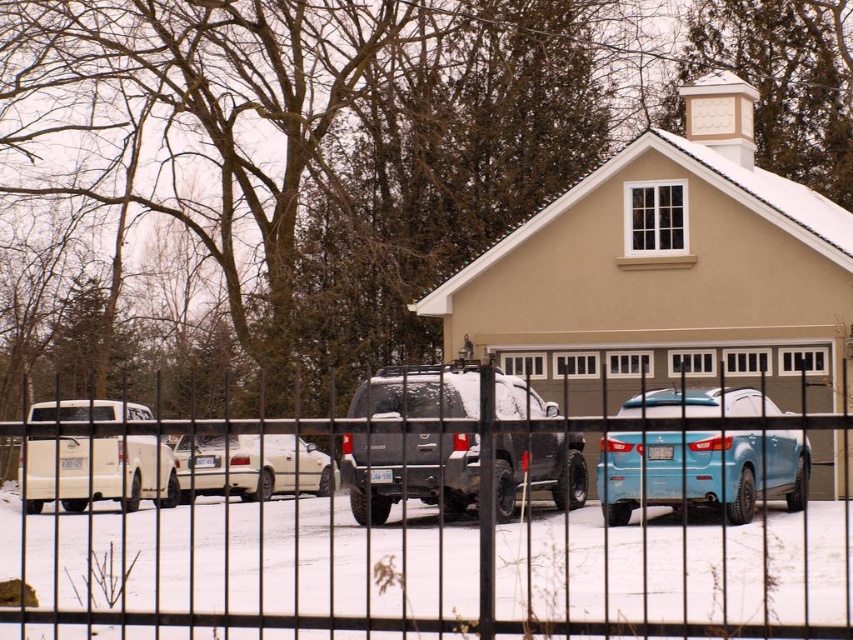
Question: Is black metal fence at center positioned before white matte truck at left?

Choices:
 (A) yes
 (B) no

Answer: (A)

Question: Does matte black suv at center come behind white matte sedan at center?

Choices:
 (A) yes
 (B) no

Answer: (A)

Question: Which object appears farthest from the camera in this image?

Choices:
 (A) white matte truck at left
 (B) beige matte garage door at center
 (C) matte black suv at center

Answer: (B)

Question: Which object is closer to the camera taking this photo?

Choices:
 (A) black metal fence at center
 (B) white matte sedan at center
 (C) beige matte garage door at center

Answer: (A)

Question: Which of the following is the closest to the observer?

Choices:
 (A) (708, 465)
 (B) (202, 605)

Answer: (B)

Question: Does black metal fence at center have a lesser width compared to light blue matte sedan at center?

Choices:
 (A) no
 (B) yes

Answer: (A)